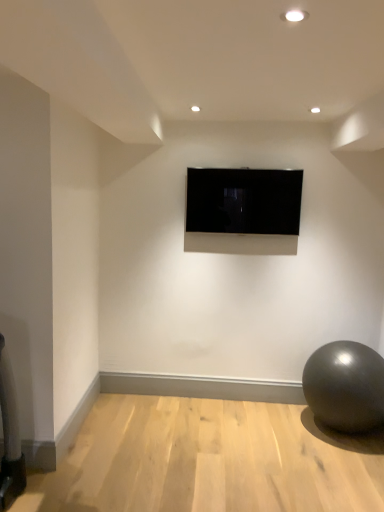
You are a GUI agent. You are given a task and a screenshot of the screen. Output one action in this format:
    pyautogui.click(x=<x>, y=<y>)
    Task: Click on the vacant area that is in front of shiny metallic ball at lower right
    This screenshot has width=384, height=512.
    Given the screenshot: What is the action you would take?
    pyautogui.click(x=346, y=469)